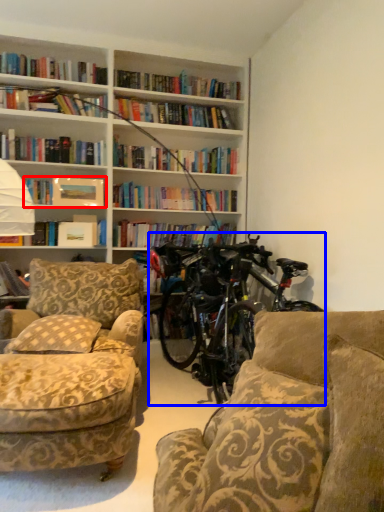
Question: Among these objects, which one is farthest to the camera, book (highlighted by a red box) or bicycle (highlighted by a blue box)?

Choices:
 (A) book
 (B) bicycle

Answer: (A)